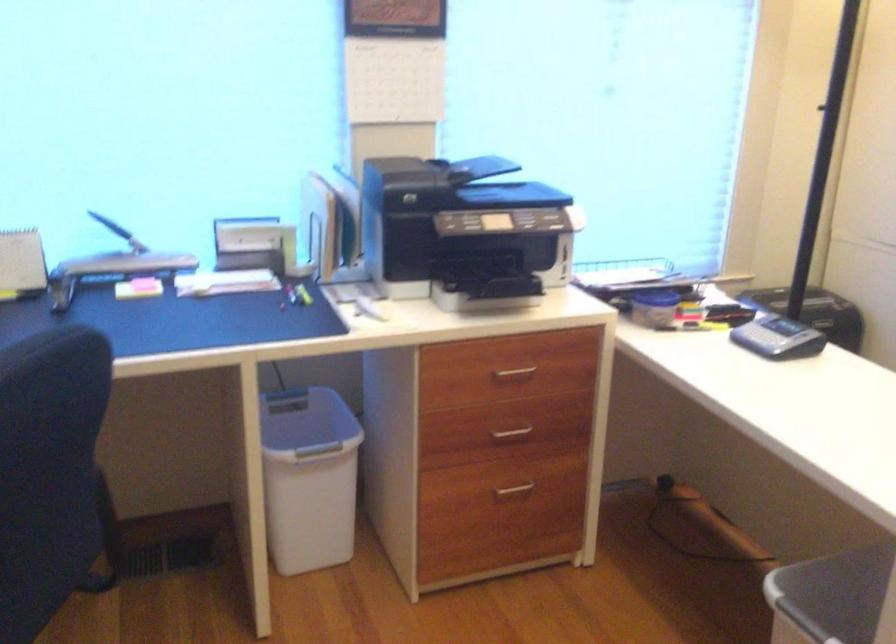
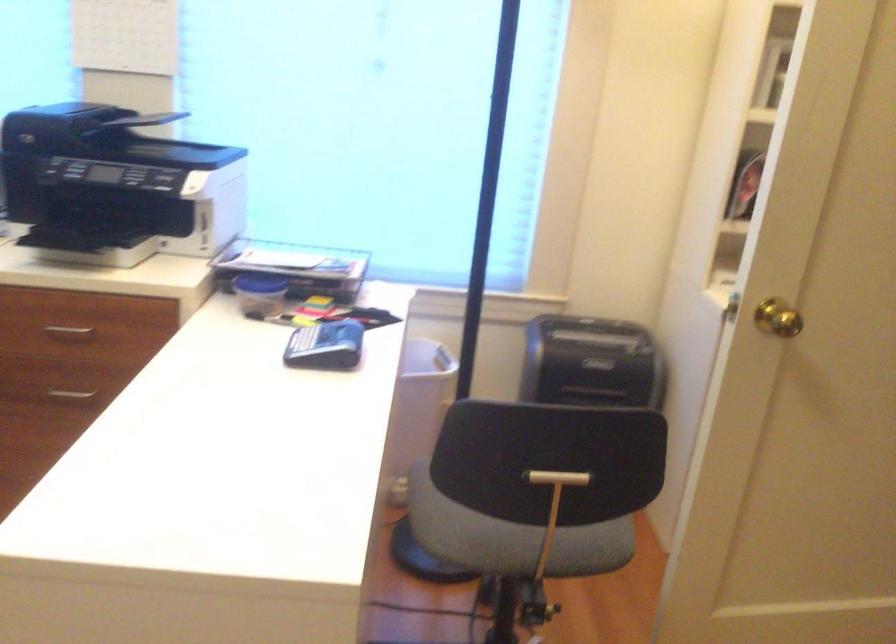
Where in the second image is the point corresponding to (x=515, y=431) from the first image?

(71, 393)